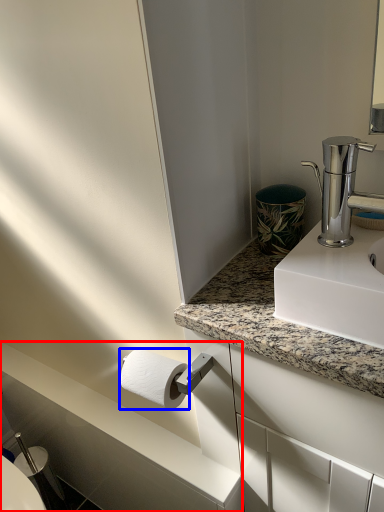
Question: Which object appears farthest to the camera in this image, counter top (highlighted by a red box) or toilet paper (highlighted by a blue box)?

Choices:
 (A) counter top
 (B) toilet paper

Answer: (A)